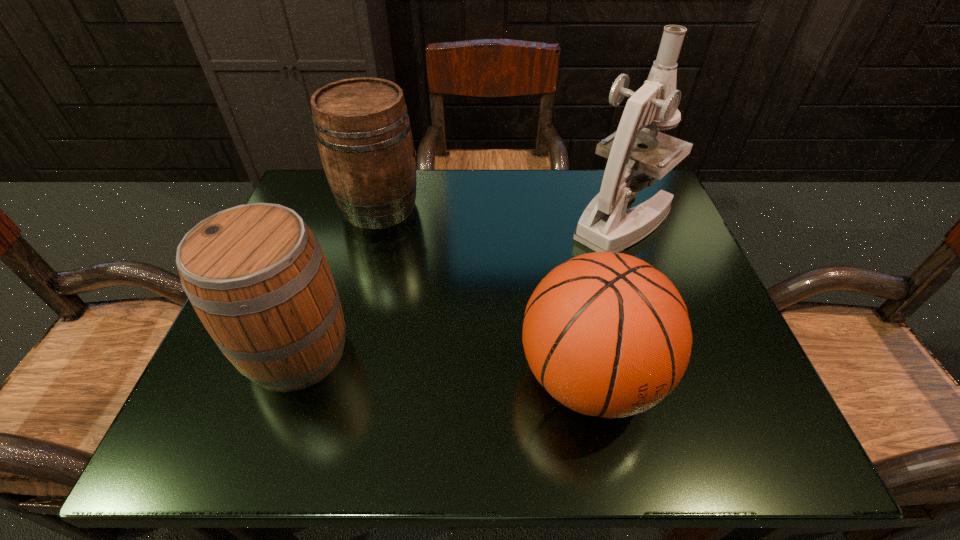
Locate an element on the screen. The image size is (960, 540). cider situated at the near edge is located at coordinates (255, 274).

Where is `basketball located at the near edge`? The width and height of the screenshot is (960, 540). basketball located at the near edge is located at coordinates (606, 334).

You are a GUI agent. You are given a task and a screenshot of the screen. Output one action in this format:
    pyautogui.click(x=<x>, y=<y>)
    Task: Click on the microscope that is positioned at the right edge
    This screenshot has width=960, height=540.
    Given the screenshot: What is the action you would take?
    pyautogui.click(x=605, y=225)

I want to click on basketball that is at the right edge, so click(x=606, y=334).

Find the location of a particular element. The image size is (960, 540). object that is at the far left corner is located at coordinates tap(363, 132).

Locate an element on the screen. The height and width of the screenshot is (540, 960). object that is at the near left corner is located at coordinates (255, 274).

Locate an element on the screen. This screenshot has width=960, height=540. object that is at the far right corner is located at coordinates (605, 225).

Where is `object present at the near right corner`? This screenshot has width=960, height=540. object present at the near right corner is located at coordinates (606, 334).

In the image, there is a desktop. Where is `vacant space at the far edge`? Image resolution: width=960 pixels, height=540 pixels. vacant space at the far edge is located at coordinates (520, 201).

Find the location of `vacant area at the near edge of the desktop`. vacant area at the near edge of the desktop is located at coordinates (441, 448).